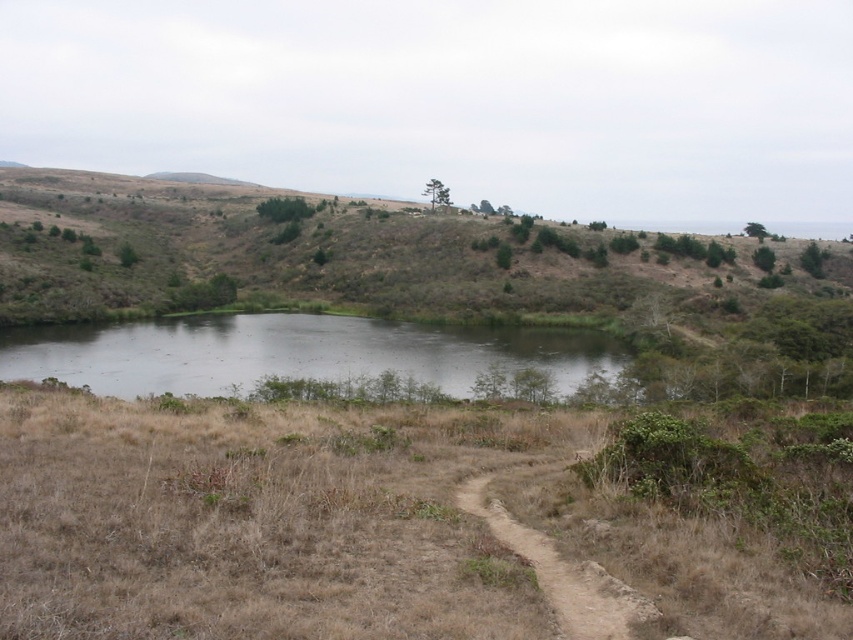
You are a hiker standing on the brown grassy hillside at center and want to reach the gray reflective water at center. Which direction should you move to get there?

The gray reflective water at center is below the brown grassy hillside at center, so you should move downward to reach it.

You are a hiker standing on the narrow dirt path in the foreground. You want to reach the gray reflective water at center. Which direction should you walk to get there, considering the brown grassy hillside at center is in your way?

The gray reflective water at center is behind the brown grassy hillside at center, so you should walk around the brown grassy hillside at center to reach the gray reflective water at center.